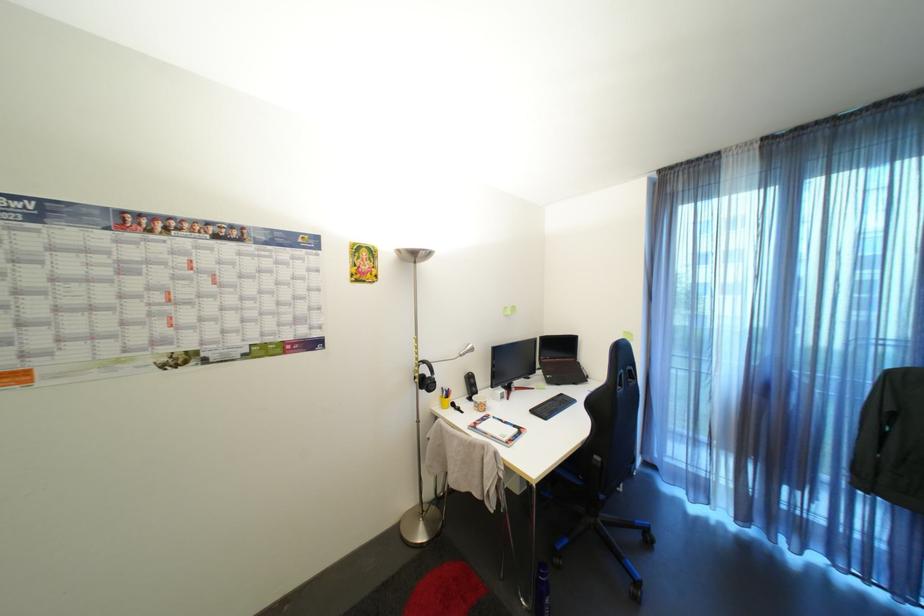
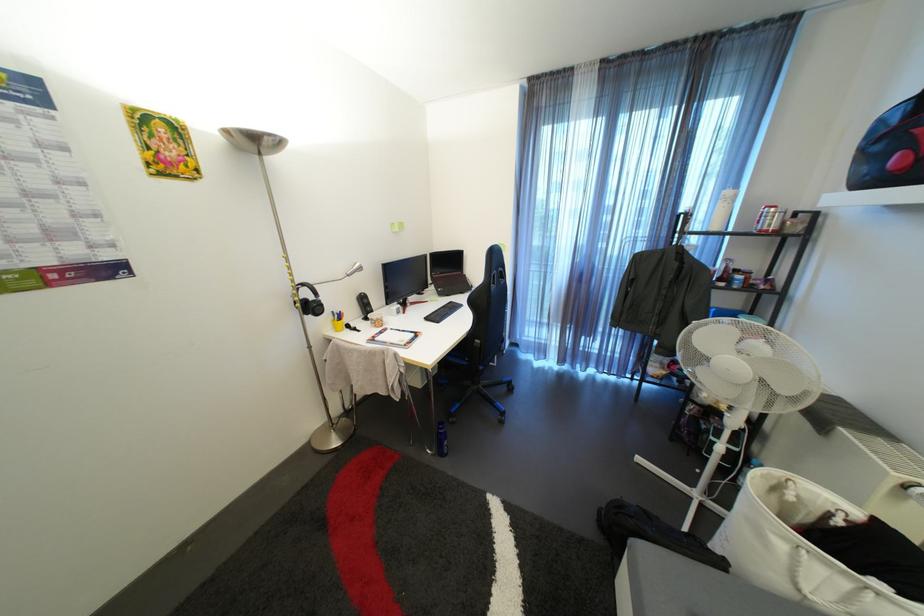
The images are taken continuously from a first-person perspective. In which direction are you moving?

The cameraman moved toward right, backward.